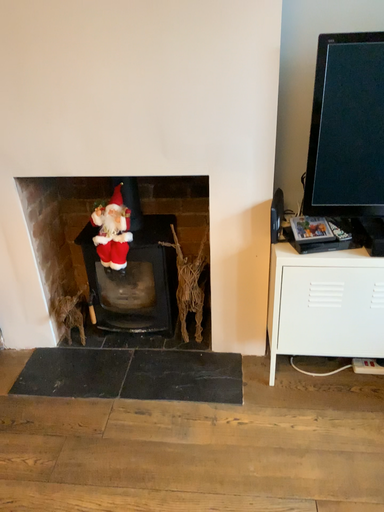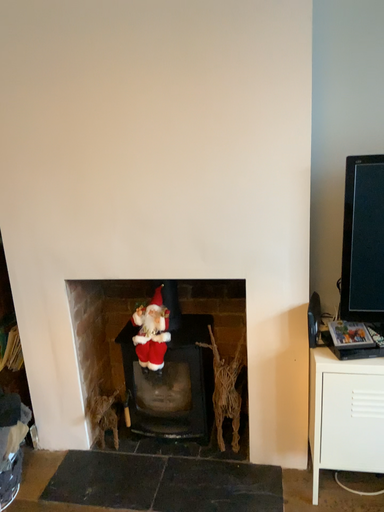
Question: How did the camera likely rotate when shooting the video?

Choices:
 (A) rotated upward
 (B) rotated downward

Answer: (A)